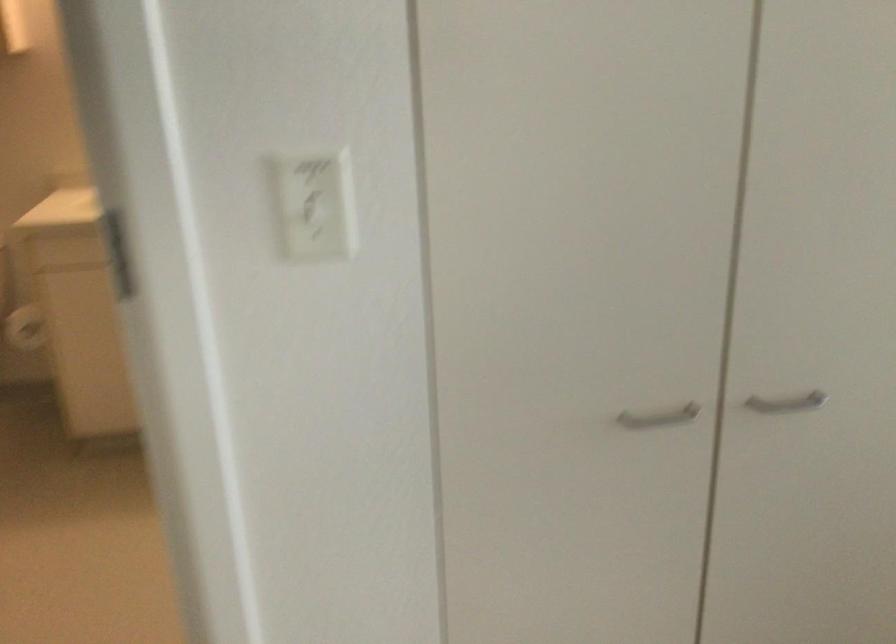
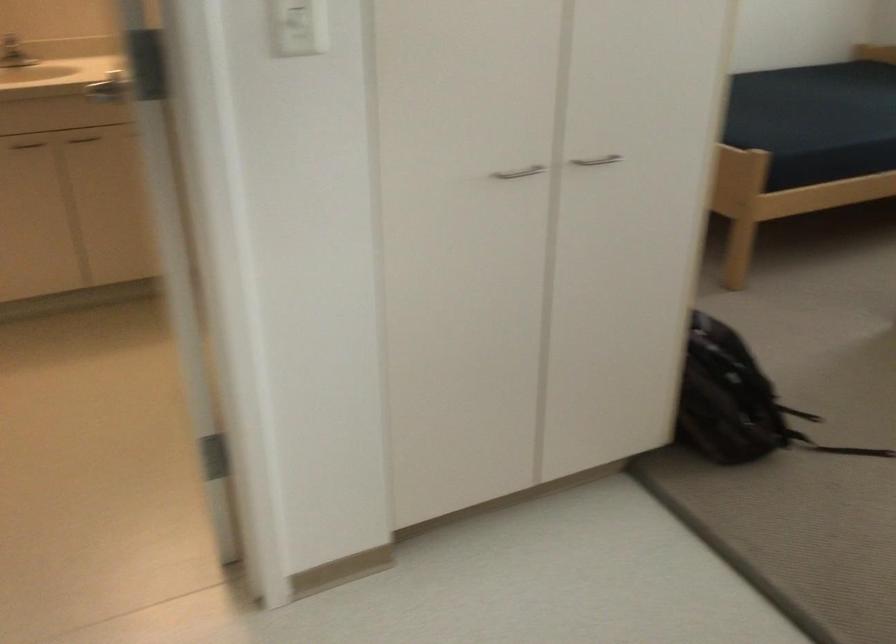
Question: The first image is from the beginning of the video and the second image is from the end. How did the camera likely rotate when shooting the video?

Choices:
 (A) Left
 (B) Right
 (C) Up
 (D) Down

Answer: (B)